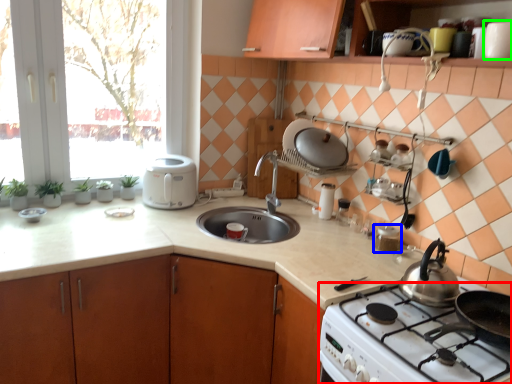
Question: Which object is positioned closest to gas stove (highlighted by a red box)? Select from appliance (highlighted by a blue box) and appliance (highlighted by a green box).

Choices:
 (A) appliance
 (B) appliance

Answer: (A)